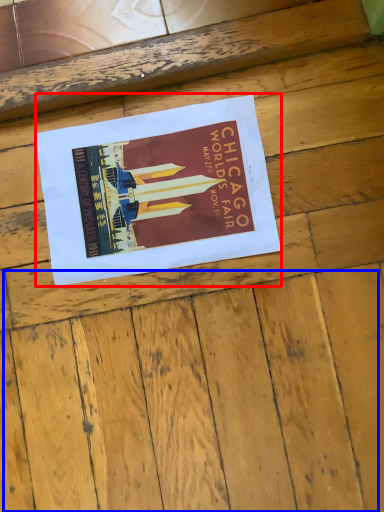
Question: Which of the following is the farthest to the observer, poster (highlighted by a red box) or plywood (highlighted by a blue box)?

Choices:
 (A) poster
 (B) plywood

Answer: (A)